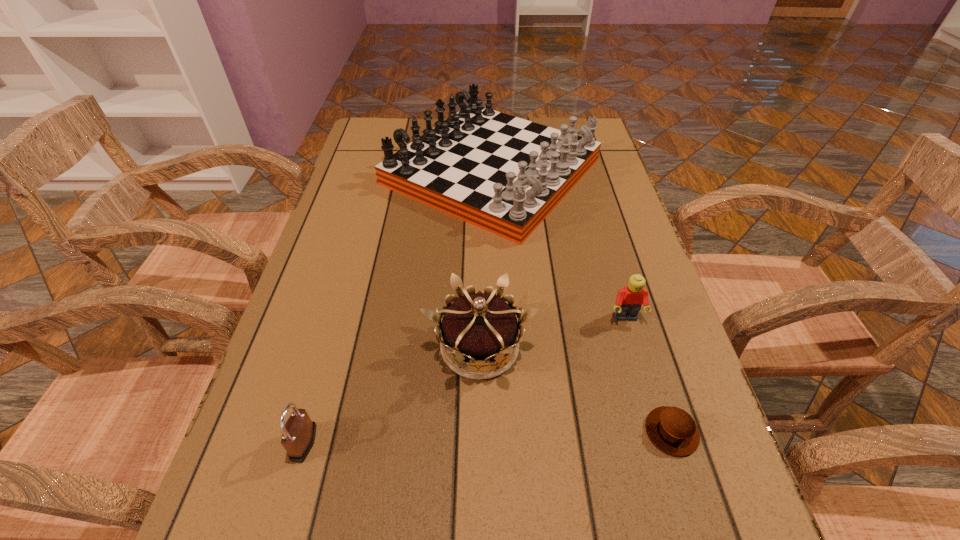
Identify the location of vacant area at the far left corner of the desktop. Image resolution: width=960 pixels, height=540 pixels. (412, 135).

You are a GUI agent. You are given a task and a screenshot of the screen. Output one action in this format:
    pyautogui.click(x=<x>, y=<y>)
    Task: Click on the free space between the crown and the muffin
    The image size is (960, 540).
    Given the screenshot: What is the action you would take?
    pyautogui.click(x=576, y=389)

Locate an element on the screen. The width and height of the screenshot is (960, 540). unoccupied position between the Lego and the padlock is located at coordinates (465, 380).

The image size is (960, 540). In order to click on vacant area between the crown and the Lego in this screenshot , I will do `click(553, 332)`.

Find the location of `free spot between the padlock and the gameboard`. free spot between the padlock and the gameboard is located at coordinates [x=397, y=307].

The image size is (960, 540). Find the location of `vacant area that lies between the gameboard and the shortest object`. vacant area that lies between the gameboard and the shortest object is located at coordinates (582, 302).

Locate an element on the screen. free space between the Lego and the gameboard is located at coordinates (559, 245).

At what (x,y) coordinates should I click in order to perform the action: click on vacant area that lies between the muffin and the padlock. Please return your answer as a coordinate pair (x, y). Looking at the image, I should click on (488, 437).

In order to click on free space between the farthest object and the muffin in this screenshot , I will do `click(582, 302)`.

Where is `free space between the padlock and the crown`? The height and width of the screenshot is (540, 960). free space between the padlock and the crown is located at coordinates (392, 395).